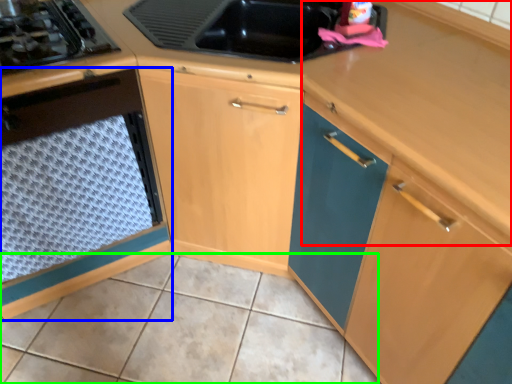
Question: Which object is the closest to the counter top (highlighted by a red box)? Choose among these: cabinetry (highlighted by a blue box) or tile (highlighted by a green box).

Choices:
 (A) cabinetry
 (B) tile

Answer: (A)